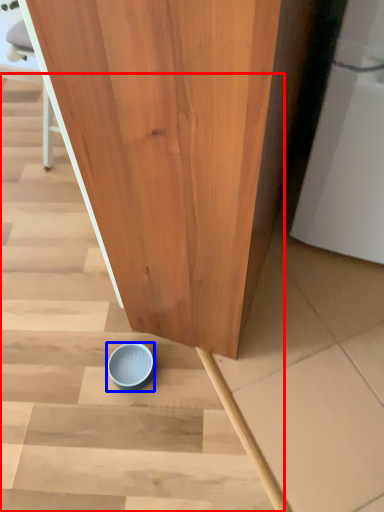
Question: Which object appears closest to the camera in this image, stairwell (highlighted by a red box) or tableware (highlighted by a blue box)?

Choices:
 (A) stairwell
 (B) tableware

Answer: (A)